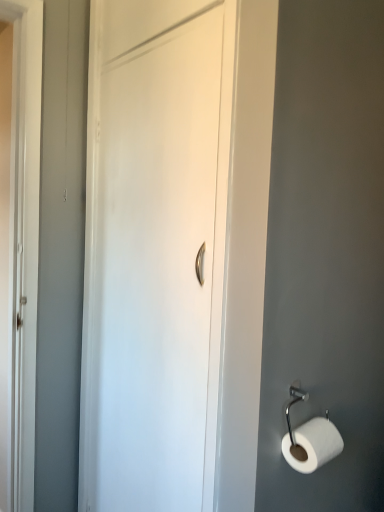
The width and height of the screenshot is (384, 512). Describe the element at coordinates (313, 444) in the screenshot. I see `white matte toilet paper at lower right` at that location.

Locate an element on the screen. Image resolution: width=384 pixels, height=512 pixels. white matte toilet paper at lower right is located at coordinates (313, 444).

What is the approximate width of white matte toilet paper at lower right?

It is 10.82 centimeters.

The image size is (384, 512). I want to click on white matte toilet paper at lower right, so click(x=313, y=444).